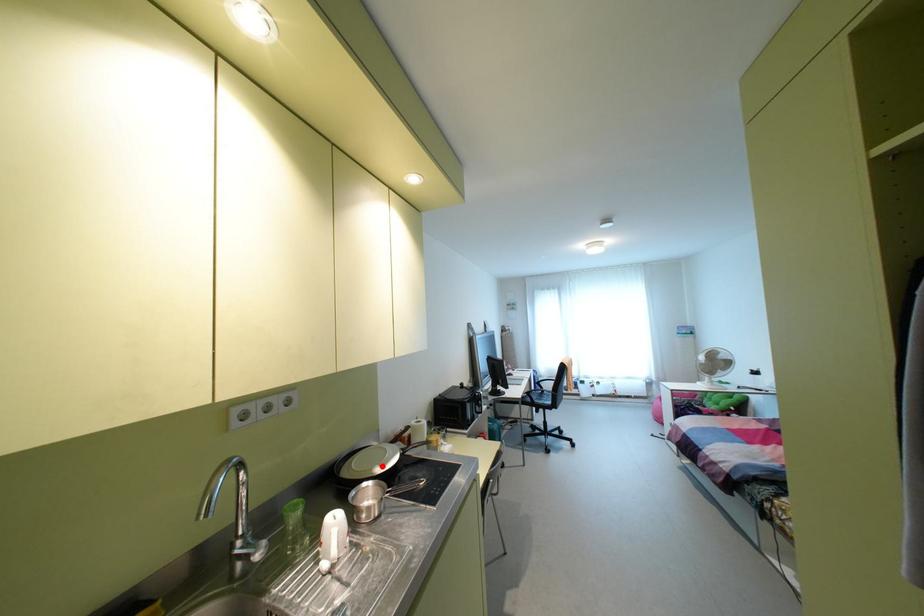
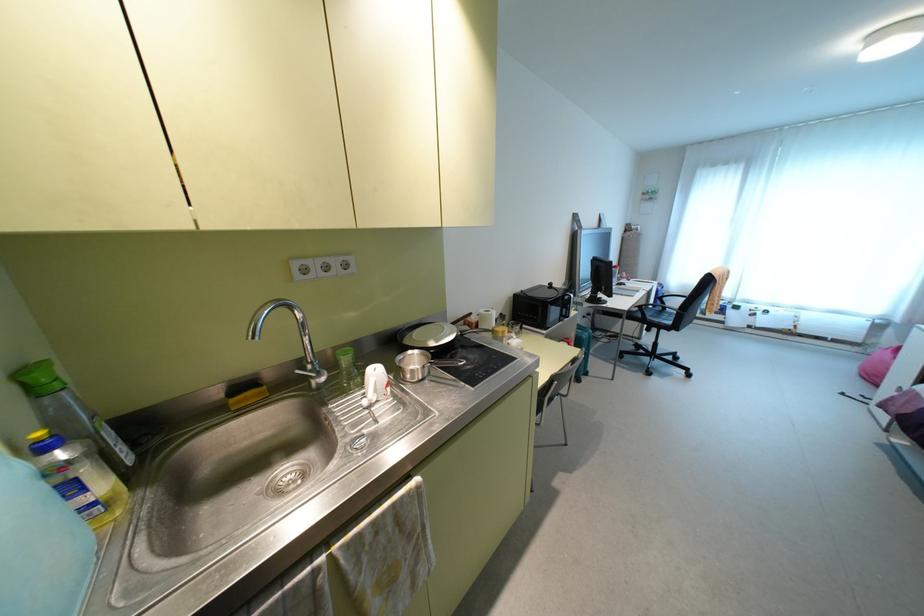
Question: I am providing you with two images of the same scene from different viewpoints. A red point is marked on the first image. Is the red point's position out of view in image 2?

Choices:
 (A) Yes
 (B) No

Answer: (B)